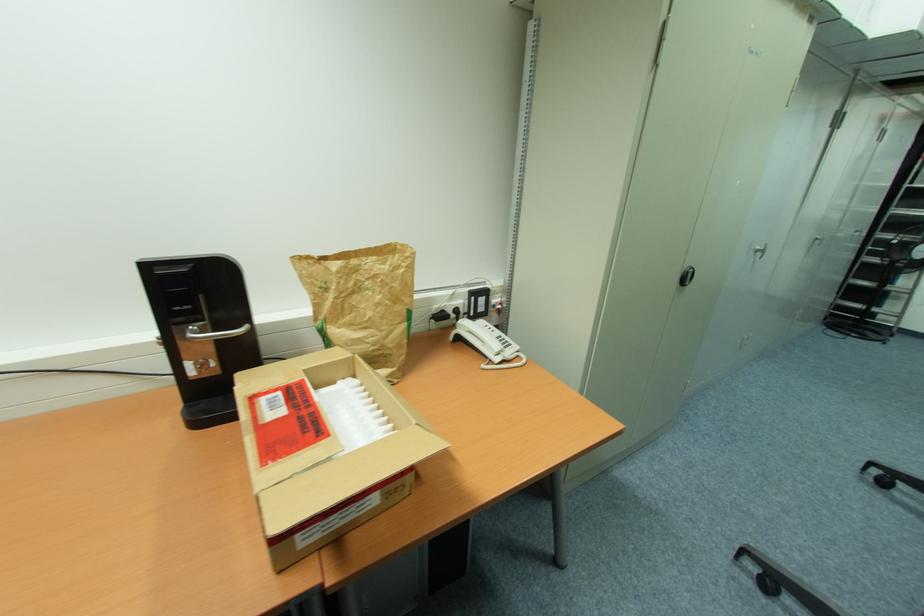
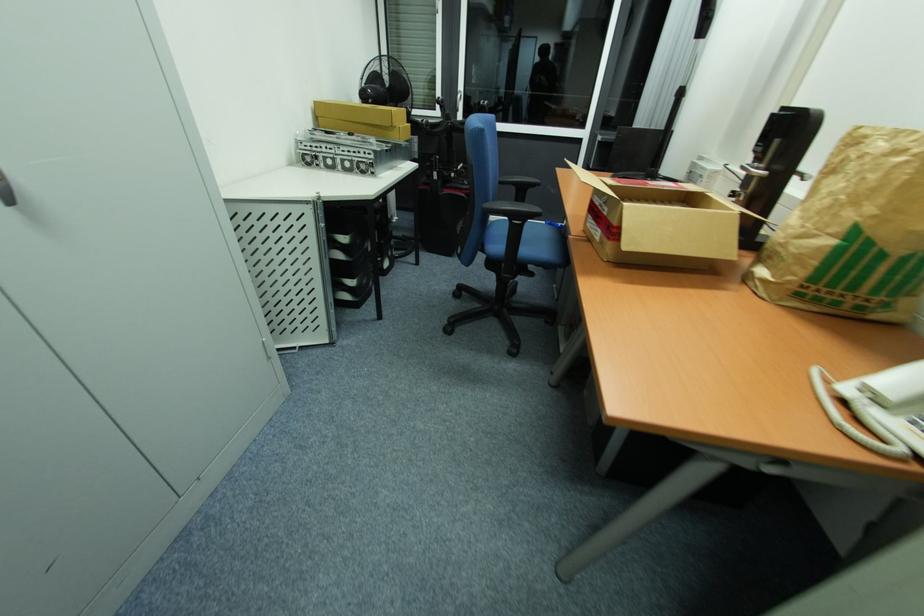
Find the pixel in the second image that matches point 380,270 in the first image.

(880, 147)